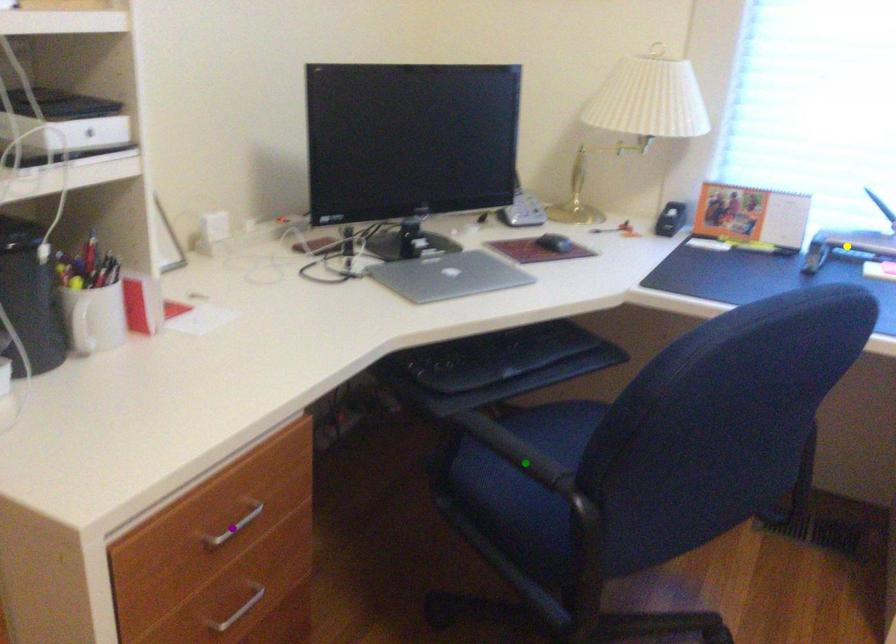
Order these from farthest to nearest:
yellow point, green point, purple point

yellow point
green point
purple point